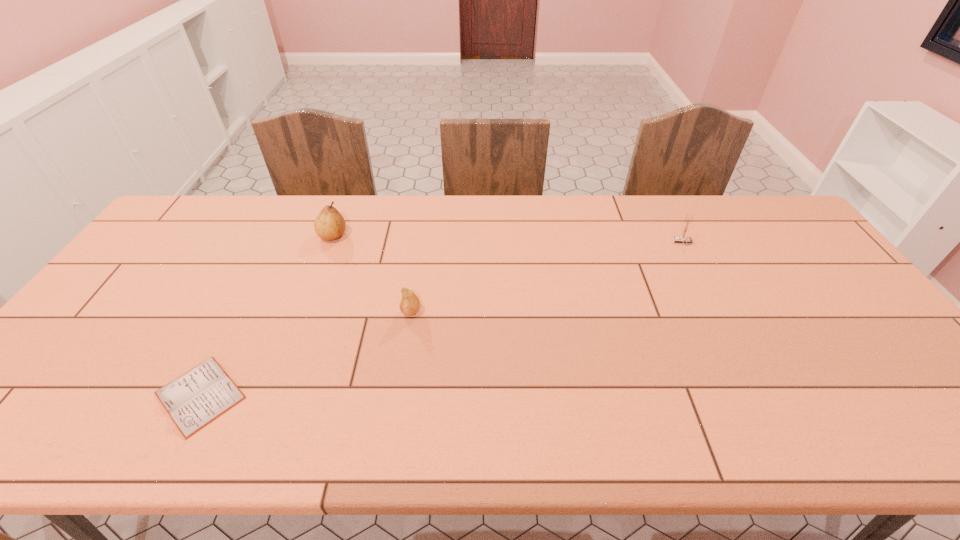
What are the coordinates of `the third object from right to left` in the screenshot? It's located at (329, 225).

I want to click on the tallest object, so click(x=329, y=225).

This screenshot has width=960, height=540. I want to click on the rightmost object, so click(683, 238).

Find the location of a particular element. the third object from left to right is located at coordinates (409, 305).

At what (x,y) coordinates should I click in order to perform the action: click on the second nearest object. Please return your answer as a coordinate pair (x, y). This screenshot has height=540, width=960. Looking at the image, I should click on 409,305.

This screenshot has height=540, width=960. Identify the location of the nearest object. (193, 400).

You are a GUI agent. You are given a task and a screenshot of the screen. Output one action in this format:
    pyautogui.click(x=<x>, y=<y>)
    Task: Click on the leftmost object
    
    Given the screenshot: What is the action you would take?
    point(193,400)

Find the location of `vacant space located 0.270m on the front of the taller pear`. vacant space located 0.270m on the front of the taller pear is located at coordinates (305, 309).

Image resolution: width=960 pixels, height=540 pixels. I want to click on vacant space located 0.290m on the right of the rightmost object, so click(782, 242).

Where is `free space located 0.170m on the right of the nearer pear`? The height and width of the screenshot is (540, 960). free space located 0.170m on the right of the nearer pear is located at coordinates (484, 311).